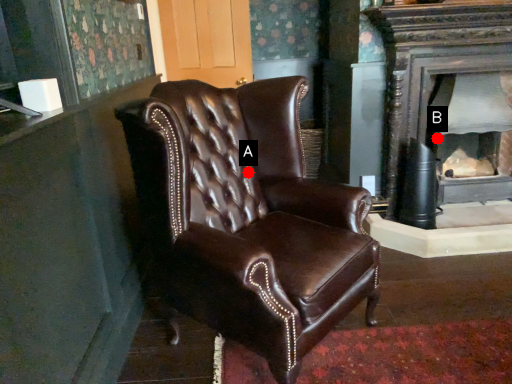
Question: Two points are circled on the image, labeled by A and B beside each circle. Which point is closer to the camera taking this photo?

Choices:
 (A) A is closer
 (B) B is closer

Answer: (A)